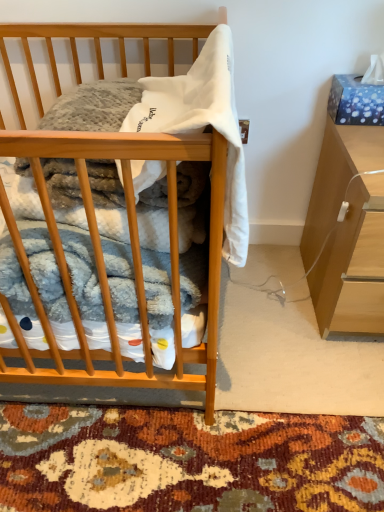
Question: Considering the relative sizes of wooden desk at center and white soft fabric at center in the image provided, is wooden desk at center shorter than white soft fabric at center?

Choices:
 (A) no
 (B) yes

Answer: (A)

Question: Is wooden desk at center bigger than white soft fabric at center?

Choices:
 (A) yes
 (B) no

Answer: (A)

Question: From a real-world perspective, is wooden desk at center physically below white soft fabric at center?

Choices:
 (A) yes
 (B) no

Answer: (A)

Question: Is wooden desk at center positioned in front of white soft fabric at center?

Choices:
 (A) yes
 (B) no

Answer: (A)

Question: Is wooden desk at center to the left of white soft fabric at center from the viewer's perspective?

Choices:
 (A) no
 (B) yes

Answer: (B)

Question: From a real-world perspective, is light brown wood cabinet at right above or below white soft fabric at center?

Choices:
 (A) below
 (B) above

Answer: (A)

Question: From the image's perspective, is light brown wood cabinet at right positioned above or below white soft fabric at center?

Choices:
 (A) above
 (B) below

Answer: (B)

Question: Is point (339, 269) closer or farther from the camera than point (148, 177)?

Choices:
 (A) closer
 (B) farther

Answer: (B)

Question: Is light brown wood cabinet at right inside or outside of white soft fabric at center?

Choices:
 (A) inside
 (B) outside

Answer: (B)

Question: Does point (94, 380) appear closer or farther from the camera than point (302, 250)?

Choices:
 (A) closer
 (B) farther

Answer: (A)

Question: From the image's perspective, relative to light brown wood cabinet at right, is wooden desk at center above or below?

Choices:
 (A) above
 (B) below

Answer: (A)

Question: In terms of width, does wooden desk at center look wider or thinner when compared to light brown wood cabinet at right?

Choices:
 (A) thin
 (B) wide

Answer: (B)

Question: Considering the positions of wooden desk at center and light brown wood cabinet at right in the image, is wooden desk at center bigger or smaller than light brown wood cabinet at right?

Choices:
 (A) big
 (B) small

Answer: (A)

Question: Is white soft fabric at center wider or thinner than wooden desk at center?

Choices:
 (A) thin
 (B) wide

Answer: (A)

Question: From their relative heights in the image, would you say white soft fabric at center is taller or shorter than wooden desk at center?

Choices:
 (A) short
 (B) tall

Answer: (A)